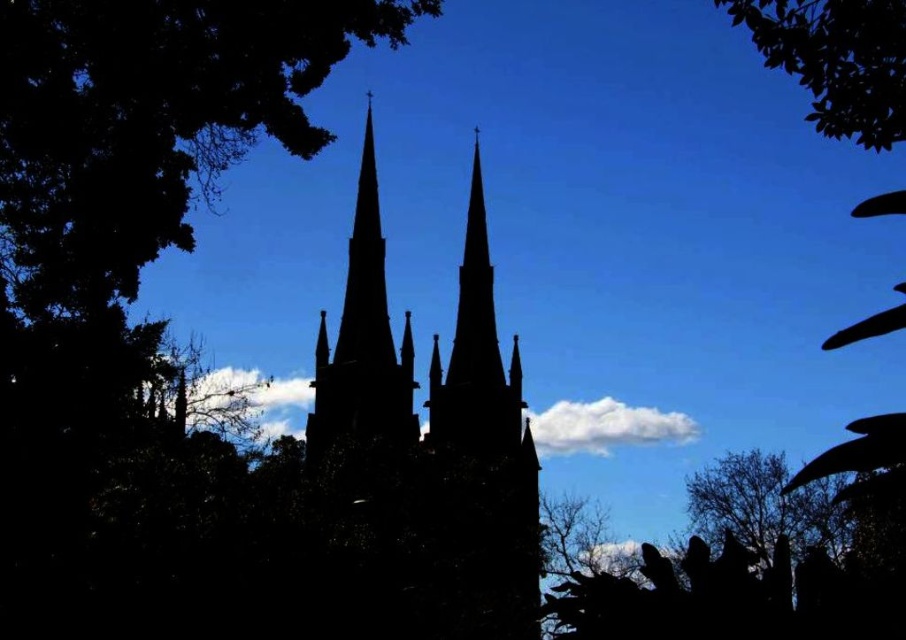
You are an architect analyzing the church silhouette. You need to determine which structure is taller between the silhouette stone tower at center and the silhouette leafy tree at lower right. Based on the scene, which one is taller?

The silhouette stone tower at center is much taller than the silhouette leafy tree at lower right.

You are an architect analyzing the Gothic church silhouette. You notice two structures at the center of the image. Which one is taller between the silhouette church at center and the silhouette stone tower at center?

The silhouette church at center is much taller than the silhouette stone tower at center, so the silhouette church at center is the taller one.

From the picture: You are an architect analyzing the Gothic church silhouette. You notice the silhouette church at center and the silhouette stone tower at center. Which one has a greater height?

The silhouette church at center is larger in size than the silhouette stone tower at center, so it has a greater height.